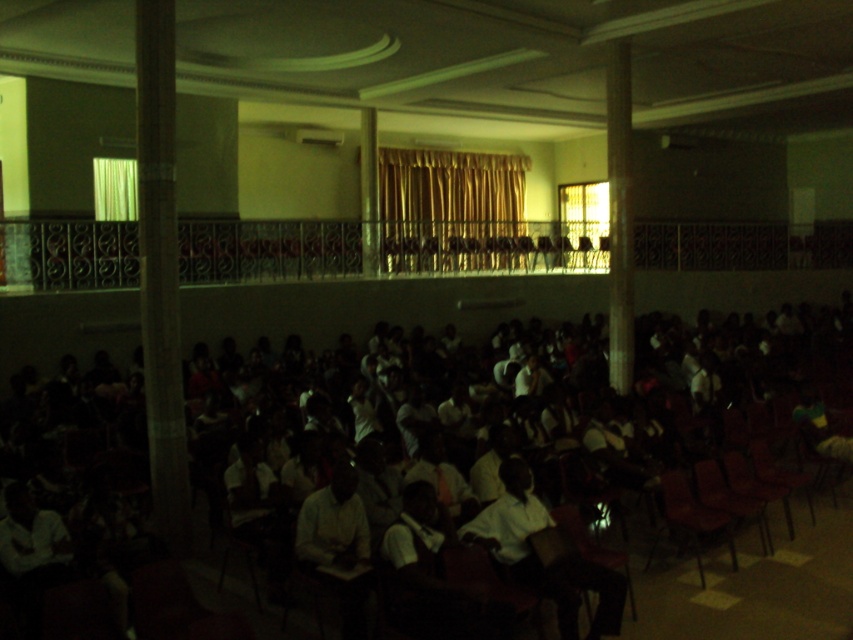
Question: From the image, what is the correct spatial relationship of brown leather chair at lower right in relation to matte brown chair at center?

Choices:
 (A) right
 (B) left

Answer: (B)

Question: Can you confirm if metallic brown chair at lower right is smaller than brown leather chair at lower right?

Choices:
 (A) no
 (B) yes

Answer: (A)

Question: In this image, where is brown leather chair at lower right located relative to matte brown chair at center?

Choices:
 (A) left
 (B) right

Answer: (A)

Question: Which is nearer to the matte brown chair at center?

Choices:
 (A) metallic brown chair at lower right
 (B) brown leather chair at lower right

Answer: (B)

Question: Which object is the closest to the metallic brown chair at lower right?

Choices:
 (A) matte brown chair at center
 (B) brown leather chair at lower right

Answer: (B)

Question: Which is farther from the brown leather chair at lower right?

Choices:
 (A) metallic brown chair at lower right
 (B) matte brown chair at center

Answer: (A)